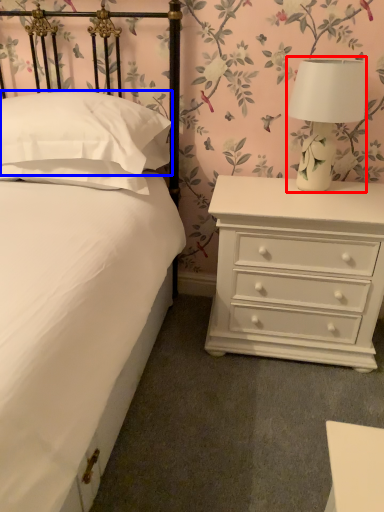
Question: Among these objects, which one is nearest to the camera, table lamp (highlighted by a red box) or pillow (highlighted by a blue box)?

Choices:
 (A) table lamp
 (B) pillow

Answer: (B)